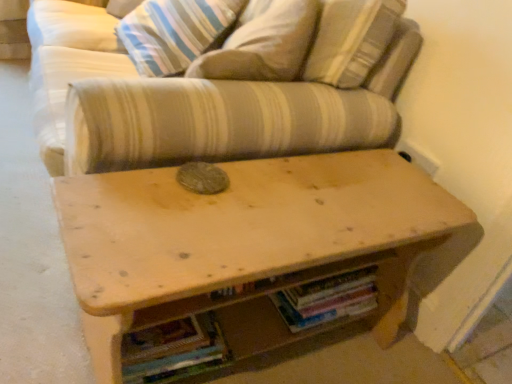
Question: From the image's perspective, would you say striped fabric couch at center is shown under wooden table at center?

Choices:
 (A) yes
 (B) no

Answer: (B)

Question: Is striped fabric couch at center far from wooden table at center?

Choices:
 (A) no
 (B) yes

Answer: (A)

Question: Is wooden table at center completely or partially inside striped fabric couch at center?

Choices:
 (A) yes
 (B) no

Answer: (B)

Question: Can you confirm if striped fabric couch at center is smaller than wooden table at center?

Choices:
 (A) no
 (B) yes

Answer: (A)

Question: From a real-world perspective, is striped fabric couch at center beneath wooden table at center?

Choices:
 (A) no
 (B) yes

Answer: (A)

Question: Is multicolored paper book at lower center, acting as the second book starting from the right, bigger or smaller than striped fabric couch at center?

Choices:
 (A) big
 (B) small

Answer: (B)

Question: From the image's perspective, is multicolored paper book at lower center, acting as the 1th book starting from the left, positioned above or below striped fabric couch at center?

Choices:
 (A) below
 (B) above

Answer: (A)

Question: Considering the positions of point (165, 370) and point (51, 4), is point (165, 370) closer or farther from the camera than point (51, 4)?

Choices:
 (A) farther
 (B) closer

Answer: (B)

Question: Is multicolored paper book at lower center, acting as the 1th book starting from the left, in front of or behind striped fabric couch at center in the image?

Choices:
 (A) behind
 (B) front

Answer: (A)

Question: Is striped fabric pillow at upper center wider or thinner than multicolored paper book at lower center, acting as the second book starting from the right?

Choices:
 (A) wide
 (B) thin

Answer: (B)

Question: Is striped fabric pillow at upper center bigger or smaller than multicolored paper book at lower center, acting as the 1th book starting from the left?

Choices:
 (A) small
 (B) big

Answer: (B)

Question: Is striped fabric pillow at upper center taller or shorter than multicolored paper book at lower center, acting as the second book starting from the right?

Choices:
 (A) short
 (B) tall

Answer: (B)

Question: Does point pos(143,21) appear closer or farther from the camera than point pos(137,375)?

Choices:
 (A) closer
 (B) farther

Answer: (B)

Question: In the image, is striped fabric couch at center positioned in front of or behind hardcover books at center, the 1th book viewed from the right?

Choices:
 (A) front
 (B) behind

Answer: (A)

Question: Considering the positions of striped fabric couch at center and hardcover books at center, which ranks as the 2th book in left-to-right order, in the image, is striped fabric couch at center bigger or smaller than hardcover books at center, which ranks as the 2th book in left-to-right order,?

Choices:
 (A) big
 (B) small

Answer: (A)